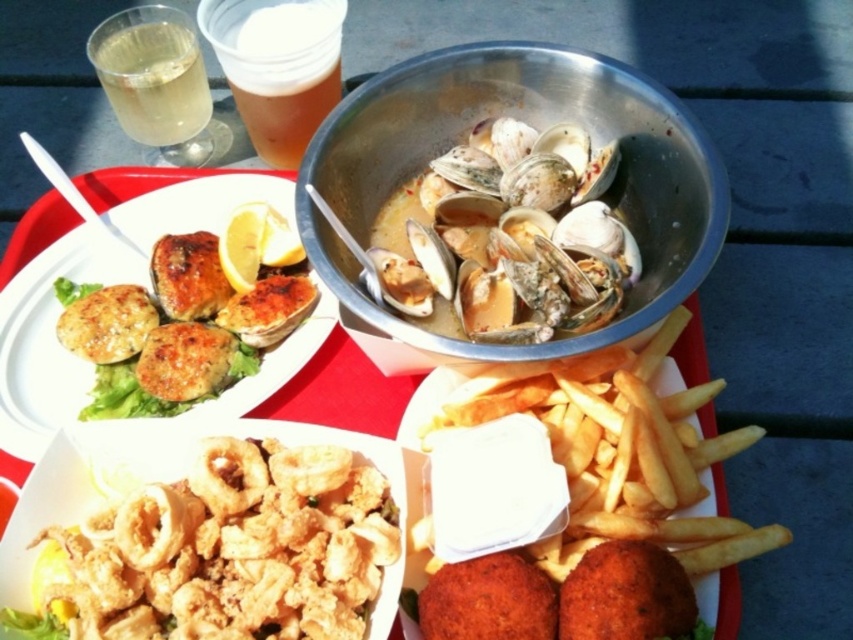
Which is above, shiny white shells at center or golden brown crusty fish cakes at upper left?

shiny white shells at center is higher up.

Where is `shiny white shells at center`? shiny white shells at center is located at coordinates (x=509, y=236).

Does shiny white shells at center appear on the right side of translucent plastic cup at upper left?

Indeed, shiny white shells at center is positioned on the right side of translucent plastic cup at upper left.

Who is lower down, shiny white shells at center or translucent plastic cup at upper left?

shiny white shells at center

Identify the location of shiny white shells at center. Image resolution: width=853 pixels, height=640 pixels. (509, 236).

Does golden brown crusty fish cakes at upper left have a greater width compared to translucent plastic cup at upper left?

Yes.

Is golden brown crusty fish cakes at upper left bigger than translucent plastic cup at upper left?

Yes, golden brown crusty fish cakes at upper left is bigger than translucent plastic cup at upper left.

Who is more forward, (216, 256) or (262, 28)?

Positioned in front is point (216, 256).

Find the location of a particular element. golden brown crusty fish cakes at upper left is located at coordinates point(183,324).